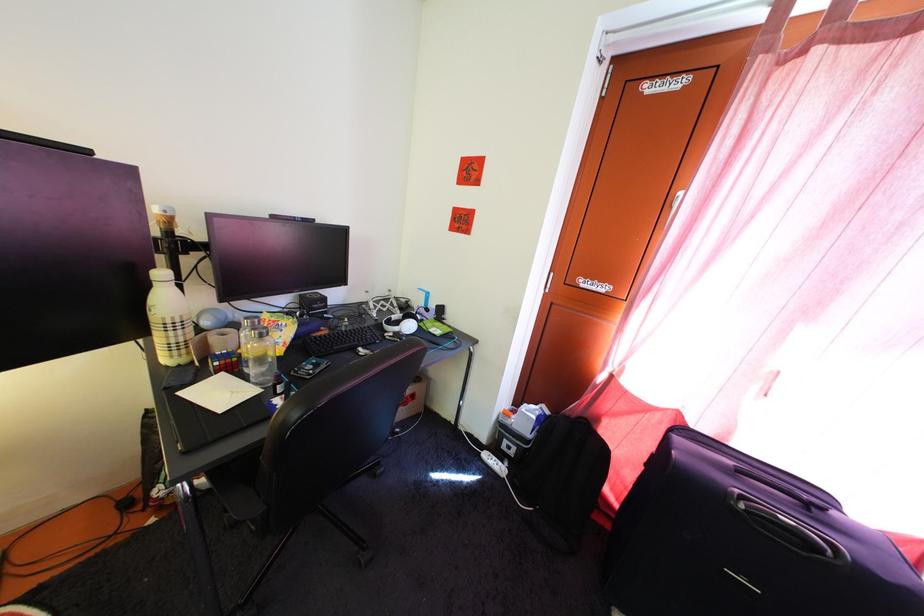
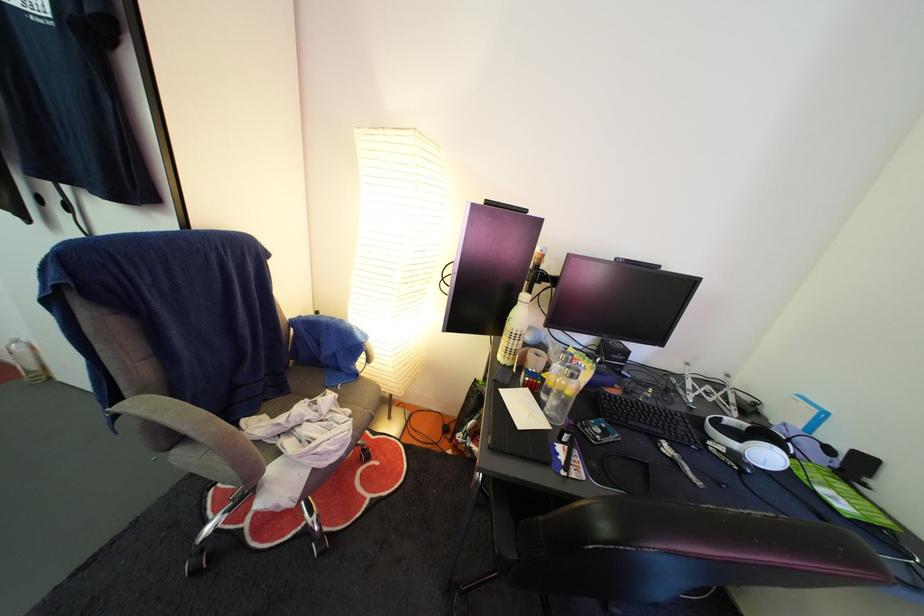
In the second image, find the point that corresponds to point (262, 338) in the first image.

(578, 376)